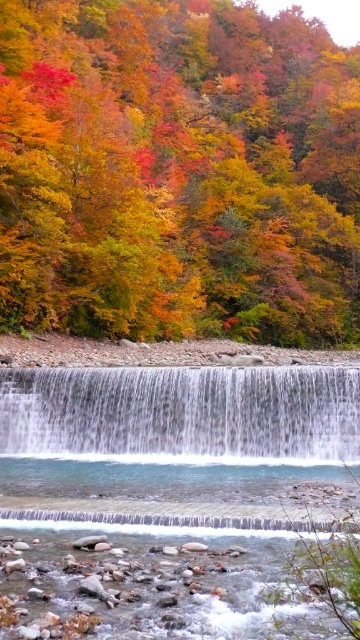
Is clear glass waterfall at center shorter than white smooth waterfall at center?

No.

Can you confirm if clear glass waterfall at center is positioned below white smooth waterfall at center?

Correct, clear glass waterfall at center is located below white smooth waterfall at center.

What do you see at coordinates (174, 488) in the screenshot? I see `clear glass waterfall at center` at bounding box center [174, 488].

Find the location of `clear glass waterfall at center`. clear glass waterfall at center is located at coordinates (174, 488).

Does multicolored autumn leaves at upper center appear on the left side of clear glass waterfall at center?

Incorrect, multicolored autumn leaves at upper center is not on the left side of clear glass waterfall at center.

Is multicolored autumn leaves at upper center positioned at the back of clear glass waterfall at center?

Yes.

The height and width of the screenshot is (640, 360). Identify the location of multicolored autumn leaves at upper center. (177, 172).

Between clear glass waterfall at center and clear water at center, which one appears on the left side from the viewer's perspective?

clear water at center

Does clear glass waterfall at center appear over clear water at center?

Correct, clear glass waterfall at center is located above clear water at center.

Is point (146, 397) in front of point (15, 573)?

No, (146, 397) is behind (15, 573).

I want to click on clear glass waterfall at center, so click(174, 488).